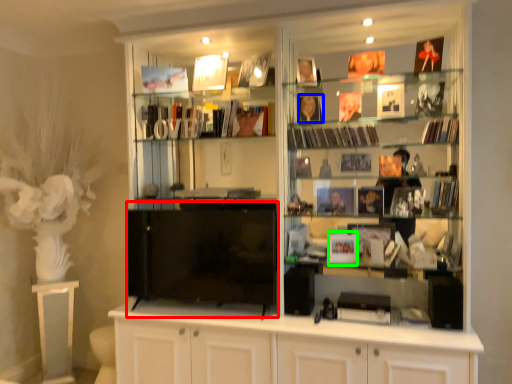
Question: Considering the real-world distances, which object is farthest from wide (highlighted by a red box)? book (highlighted by a blue box) or book (highlighted by a green box)?

Choices:
 (A) book
 (B) book

Answer: (A)